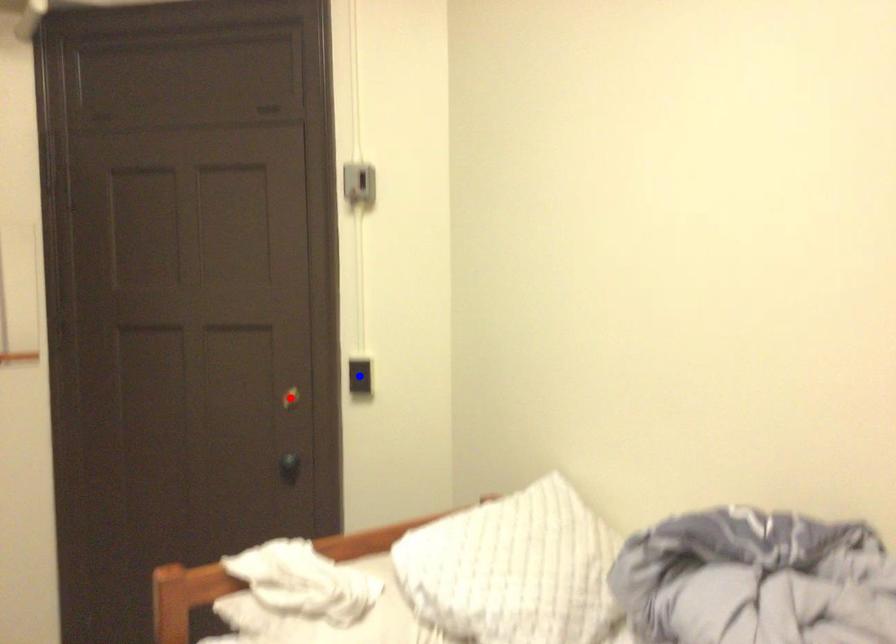
Question: In the image, two points are highlighted. Which point is nearer to the camera? Reply with the corresponding letter.

Choices:
 (A) blue point
 (B) red point

Answer: (A)